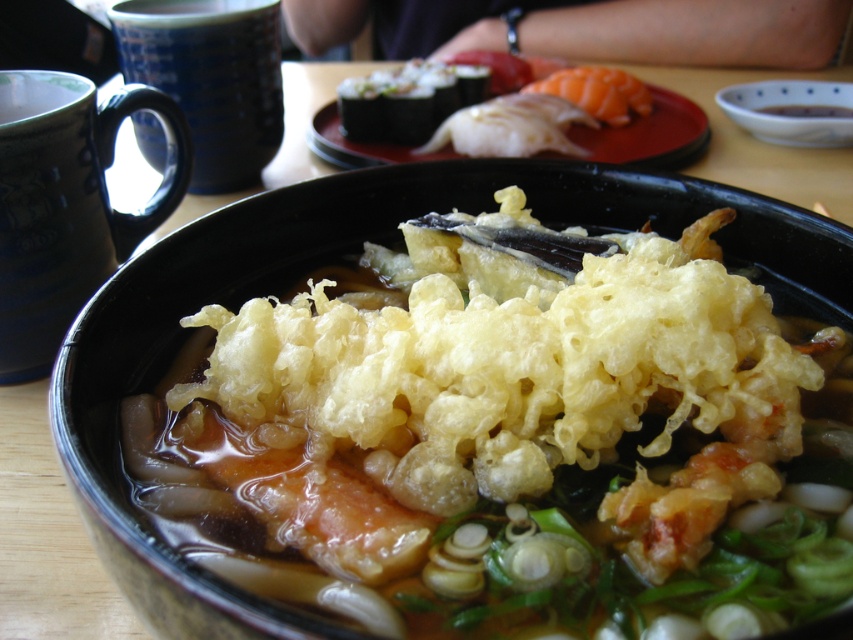
Who is more forward, (527, 541) or (155, 140)?

Point (527, 541)

Is golden crispy tempura at center to the right of blue ceramic mug at upper left from the viewer's perspective?

Indeed, golden crispy tempura at center is positioned on the right side of blue ceramic mug at upper left.

Image resolution: width=853 pixels, height=640 pixels. What are the coordinates of `golden crispy tempura at center` in the screenshot? It's located at (512, 440).

What do you see at coordinates (512, 440) in the screenshot? I see `golden crispy tempura at center` at bounding box center [512, 440].

From the picture: Is golden crispy tempura at center shorter than matte ceramic mug at upper left?

Yes.

This screenshot has height=640, width=853. I want to click on golden crispy tempura at center, so click(x=512, y=440).

Who is positioned more to the left, matte ceramic mug at upper left or blue ceramic mug at upper left?

From the viewer's perspective, matte ceramic mug at upper left appears more on the left side.

Who is positioned more to the right, matte ceramic mug at upper left or blue ceramic mug at upper left?

Positioned to the right is blue ceramic mug at upper left.

Does point (33, 74) come in front of point (155, 44)?

Yes, it is in front of point (155, 44).

Image resolution: width=853 pixels, height=640 pixels. I want to click on matte ceramic mug at upper left, so click(67, 204).